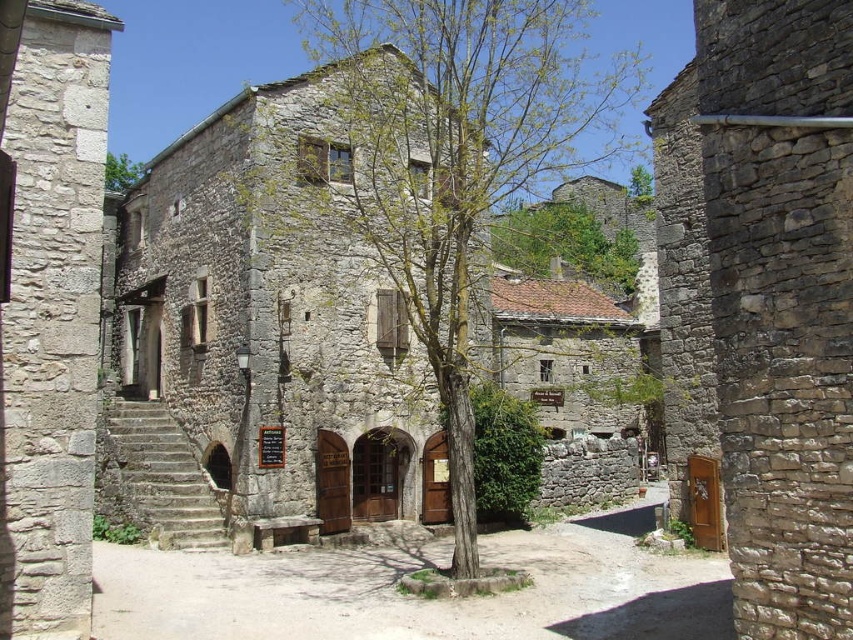
Is dull stone alley at center behind green leafy tree at upper center?

No, it is not.

How distant is dull stone alley at center from green leafy tree at upper center?

A distance of 35.99 meters exists between dull stone alley at center and green leafy tree at upper center.

Looking at this image, measure the distance between dull stone alley at center and camera.

dull stone alley at center and camera are 100.08 feet apart.

The height and width of the screenshot is (640, 853). In order to click on dull stone alley at center in this screenshot , I will do `click(416, 598)`.

Does point (440, 48) come behind point (207, 604)?

That is True.

Is green leafy tree at center positioned behind dull stone alley at center?

Yes, green leafy tree at center is behind dull stone alley at center.

You are a GUI agent. You are given a task and a screenshot of the screen. Output one action in this format:
    pyautogui.click(x=<x>, y=<y>)
    Task: Click on the green leafy tree at center
    This screenshot has width=853, height=640.
    Given the screenshot: What is the action you would take?
    pyautogui.click(x=448, y=157)

Is green leafy tree at center to the left of green leafy tree at upper center from the viewer's perspective?

In fact, green leafy tree at center is to the right of green leafy tree at upper center.

Who is more distant from viewer, (x=323, y=67) or (x=128, y=157)?

Point (x=128, y=157)

Identify the location of green leafy tree at center. This screenshot has width=853, height=640. (448, 157).